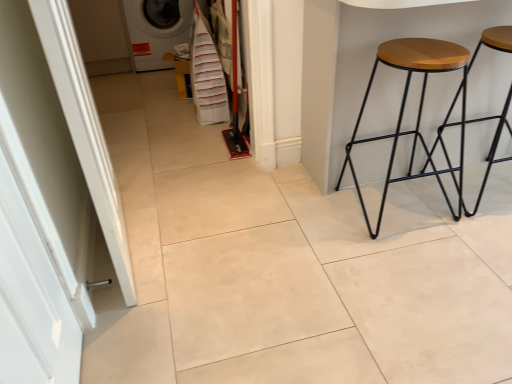
Find the location of a particular element. vacant area that lies in front of wooden stool at right is located at coordinates (298, 260).